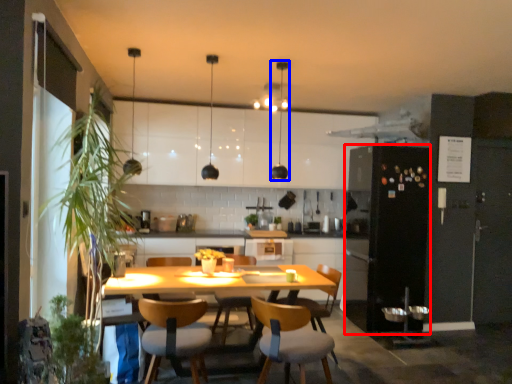
Question: Which of the following is the closest to the observer, fridge (highlighted by a red box) or light fixture (highlighted by a blue box)?

Choices:
 (A) fridge
 (B) light fixture

Answer: (B)